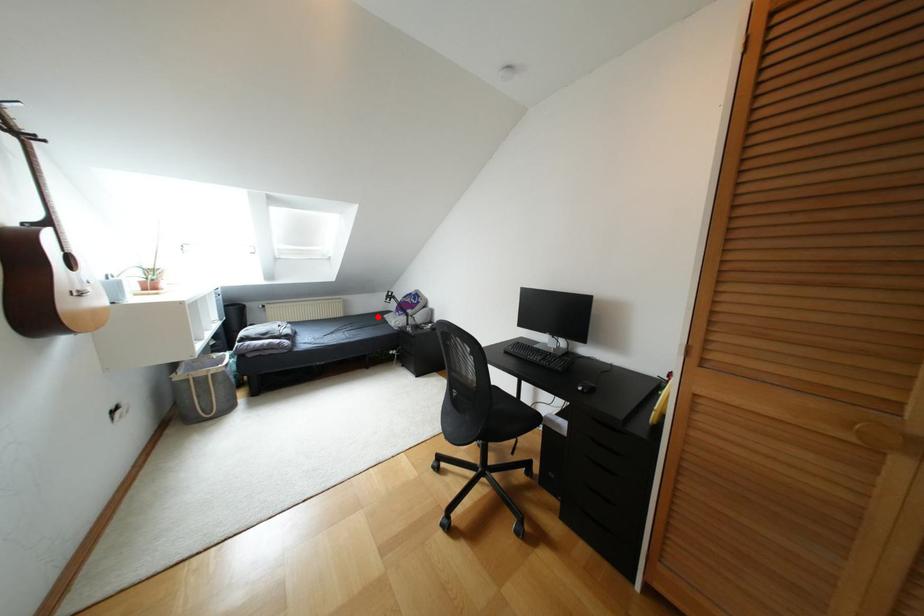
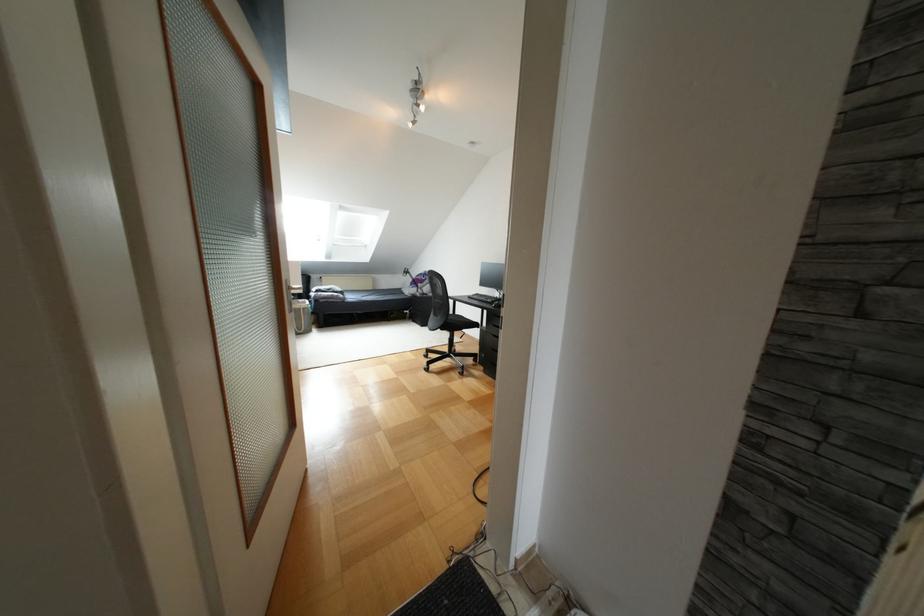
Find the pixel in the second image that matches the highlighted location in the first image.

(396, 290)